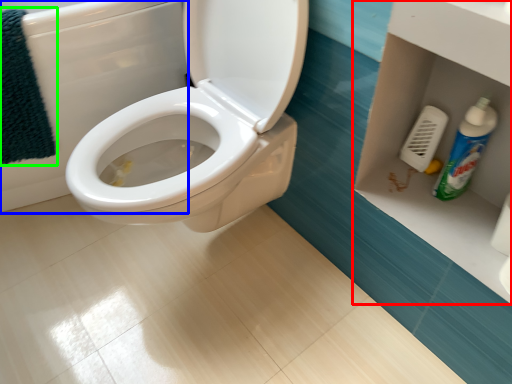
Question: Which is farther away from shelf (highlighted by a red box)? bath (highlighted by a blue box) or bath towel (highlighted by a green box)?

Choices:
 (A) bath
 (B) bath towel

Answer: (B)